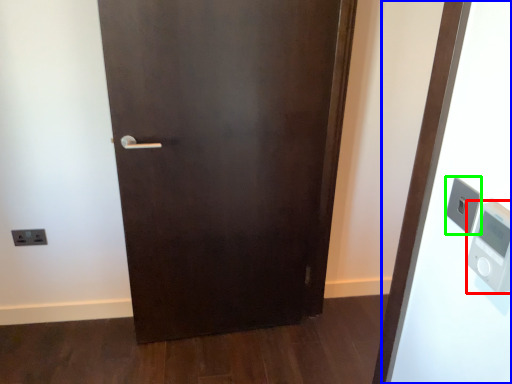
Question: Based on their relative distances, which object is nearer to thermometer (highlighted by a red box)? Choose from elevator (highlighted by a blue box) and light switch (highlighted by a green box).

Choices:
 (A) elevator
 (B) light switch

Answer: (B)